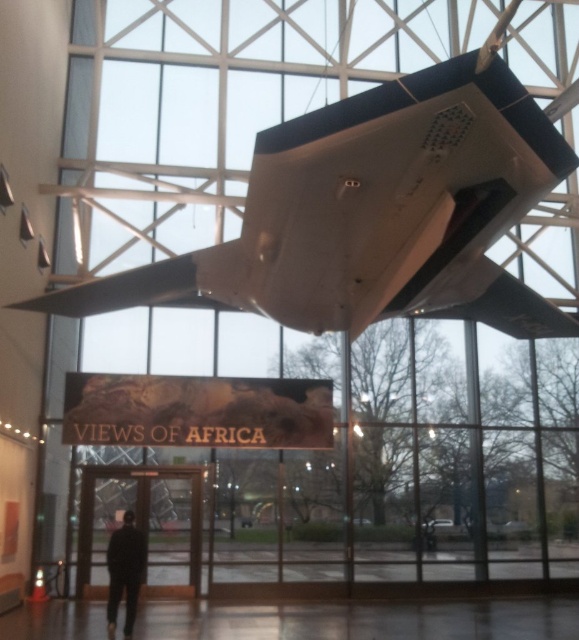
Question: Among these points, which one is nearest to the camera?

Choices:
 (A) coord(256,182)
 (B) coord(126,529)

Answer: (A)

Question: Does white matte airplane at upper center appear under black matte suit at lower left?

Choices:
 (A) yes
 (B) no

Answer: (B)

Question: Does white matte airplane at upper center have a lesser width compared to black matte suit at lower left?

Choices:
 (A) no
 (B) yes

Answer: (A)

Question: Is white matte airplane at upper center wider than black matte suit at lower left?

Choices:
 (A) no
 (B) yes

Answer: (B)

Question: Among these objects, which one is nearest to the camera?

Choices:
 (A) white matte airplane at upper center
 (B) black matte suit at lower left

Answer: (A)